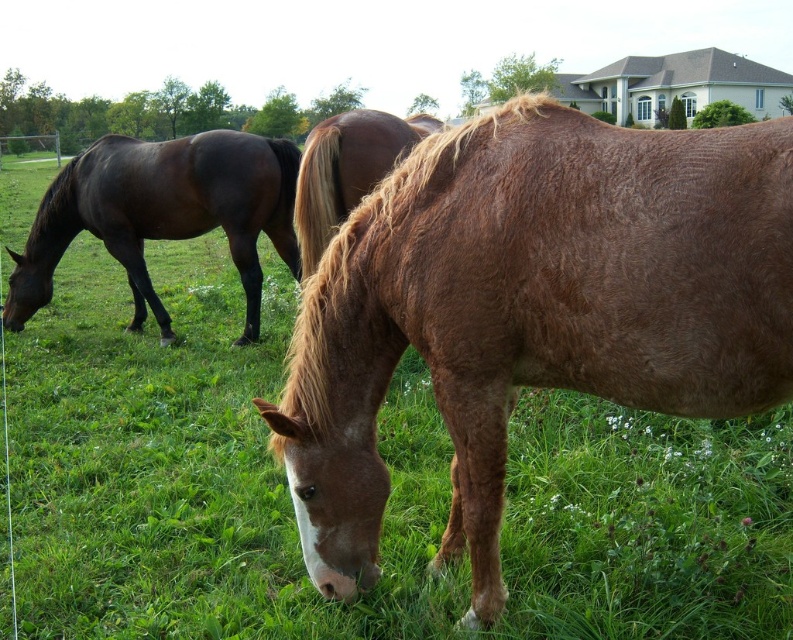
Question: Is brown fuzzy horse at center positioned behind brown shiny horse at center?

Choices:
 (A) yes
 (B) no

Answer: (B)

Question: Which point appears farthest from the camera in this image?

Choices:
 (A) (460, 211)
 (B) (431, 125)
 (C) (142, 196)

Answer: (B)

Question: Which of the following is the farthest from the observer?

Choices:
 (A) (587, 205)
 (B) (209, 218)

Answer: (B)

Question: Is shiny dark brown horse at left smaller than brown shiny horse at center?

Choices:
 (A) no
 (B) yes

Answer: (A)

Question: Considering the real-world distances, which object is farthest from the brown shiny horse at center?

Choices:
 (A) brown fuzzy horse at center
 (B) shiny dark brown horse at left

Answer: (B)

Question: From the image, what is the correct spatial relationship of brown fuzzy horse at center in relation to brown shiny horse at center?

Choices:
 (A) right
 (B) left

Answer: (A)